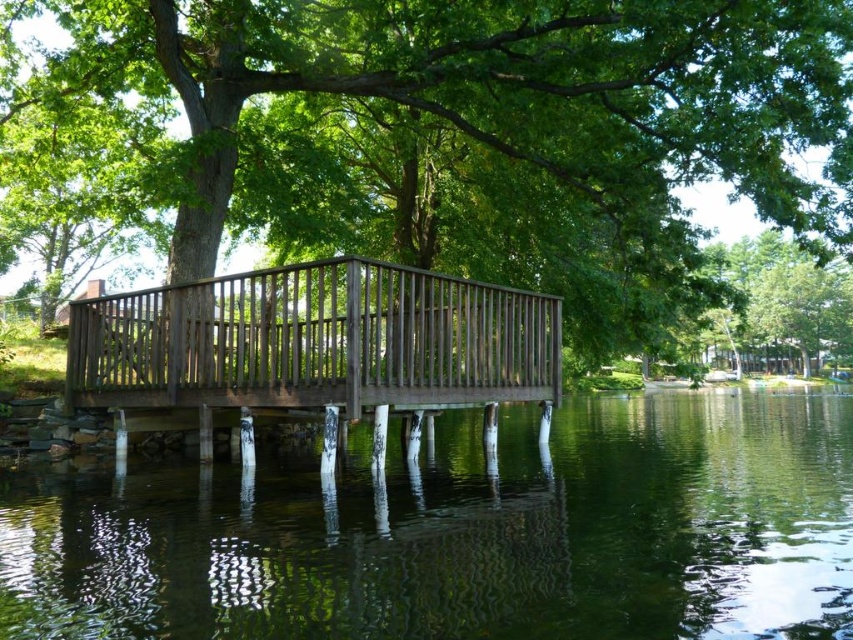
In order to click on green wood tree at center in this screenshot , I will do `click(436, 138)`.

Who is more forward, (250, 40) or (59, 564)?

Point (59, 564) is more forward.

The height and width of the screenshot is (640, 853). Describe the element at coordinates (436, 138) in the screenshot. I see `green wood tree at center` at that location.

You are a GUI agent. You are given a task and a screenshot of the screen. Output one action in this format:
    pyautogui.click(x=<x>, y=<y>)
    Task: Click on the green wood tree at center
    This screenshot has height=640, width=853.
    Given the screenshot: What is the action you would take?
    pyautogui.click(x=436, y=138)

Is dark brown wood rail at center to the left of green leafy tree at upper right from the viewer's perspective?

Correct, you'll find dark brown wood rail at center to the left of green leafy tree at upper right.

Is dark brown wood rail at center further to camera compared to green leafy tree at upper right?

That is False.

Which is in front, point (437, 339) or point (831, 307)?

Point (437, 339) is more forward.

Locate an element on the screen. This screenshot has height=640, width=853. dark brown wood rail at center is located at coordinates (315, 340).

Is point (10, 77) farther from camera compared to point (544, 387)?

Yes.

Does green wood tree at center appear over dark brown wood rail at center?

Correct, green wood tree at center is located above dark brown wood rail at center.

Which is in front, point (659, 3) or point (334, 280)?

Point (334, 280) is more forward.

The height and width of the screenshot is (640, 853). Identify the location of green wood tree at center. (436, 138).